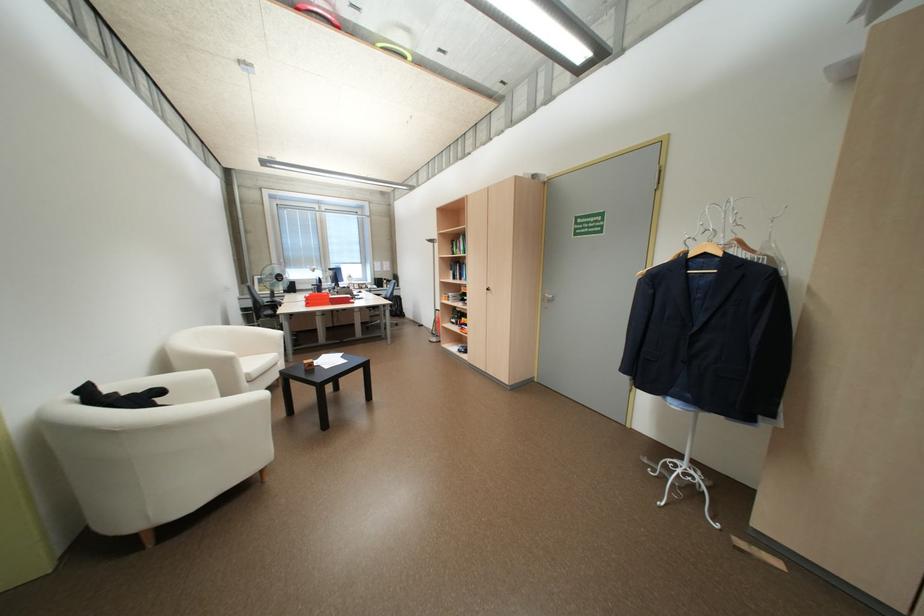
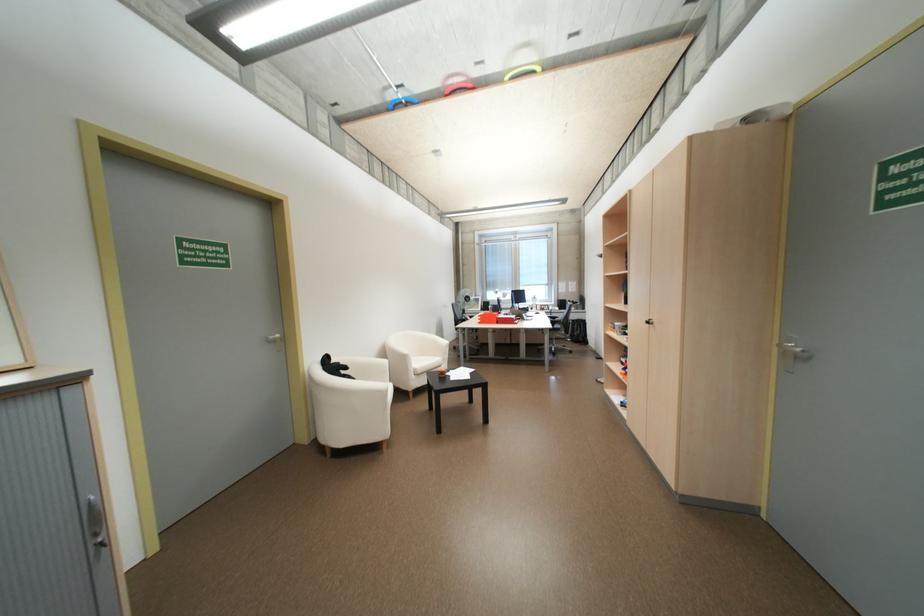
Locate, in the second image, the point that corresponds to (x=553, y=299) in the first image.

(795, 353)